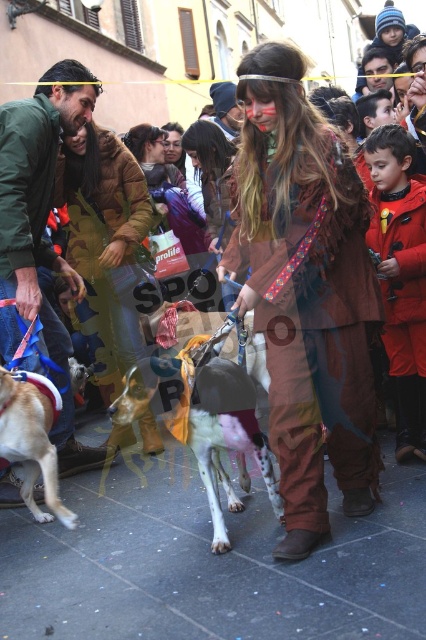
Question: Which of the following is the farthest from the observer?

Choices:
 (A) light brown fur at lower left
 (B) camouflage fabric jacket at center
 (C) smooth brown leather jacket at upper center
 (D) white fur dog at center

Answer: (C)

Question: Does green matte jacket at left have a smaller size compared to smooth brown leather jacket at upper center?

Choices:
 (A) yes
 (B) no

Answer: (A)

Question: Estimate the real-world distances between objects in this image. Which object is farther from the white fur dog at center?

Choices:
 (A) light brown fur at lower left
 (B) brown leather jacket at center
 (C) red fleece jacket at right

Answer: (B)

Question: Which point is closer to the camera?

Choices:
 (A) smooth brown leather jacket at upper center
 (B) white fur dog at center
 (C) brown leather jacket at center

Answer: (B)

Question: Is green matte jacket at left closer to camera compared to white fur dog at center?

Choices:
 (A) yes
 (B) no

Answer: (B)

Question: Does brown suede vest at center appear over smooth brown leather jacket at upper center?

Choices:
 (A) yes
 (B) no

Answer: (B)